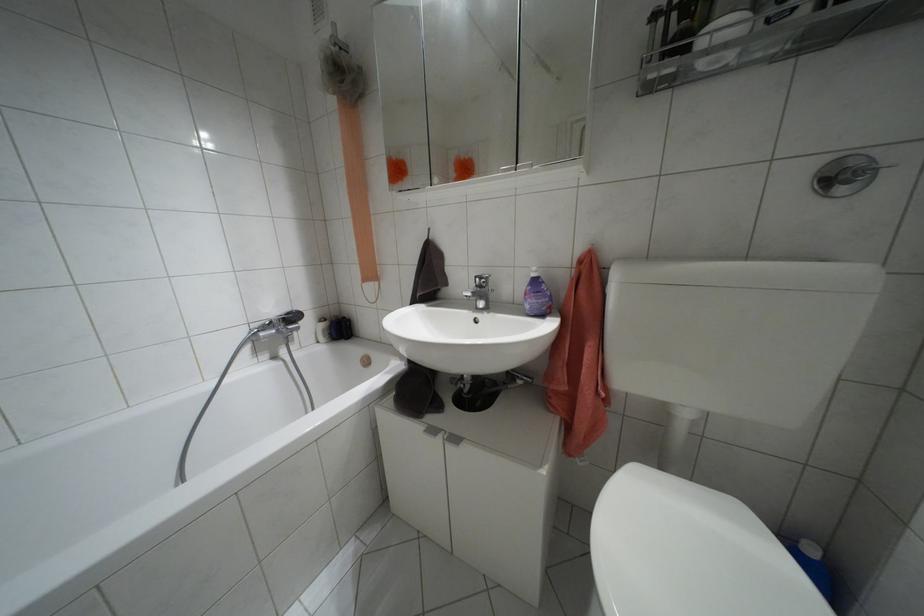
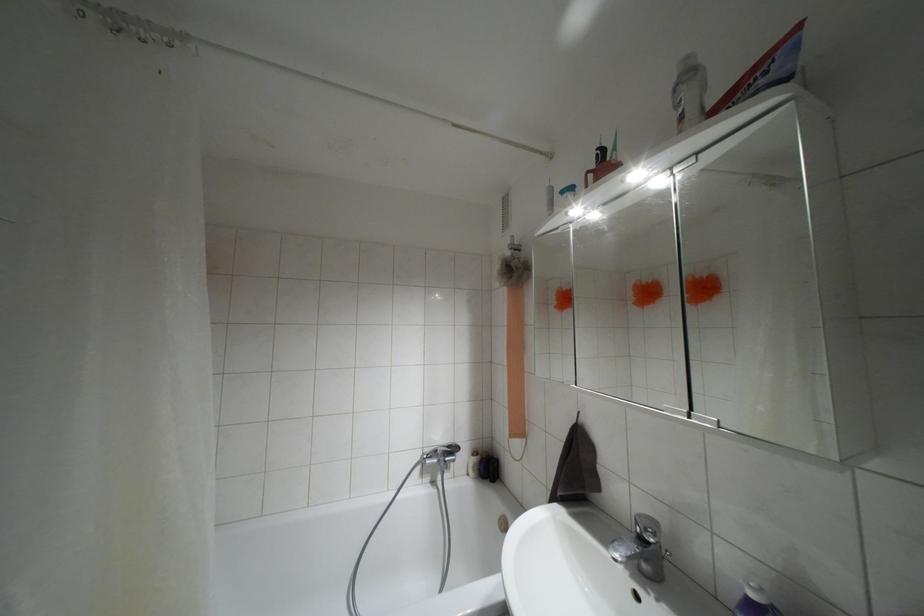
Find the pixel in the second image that matches point 286,313 in the first image.

(447, 446)